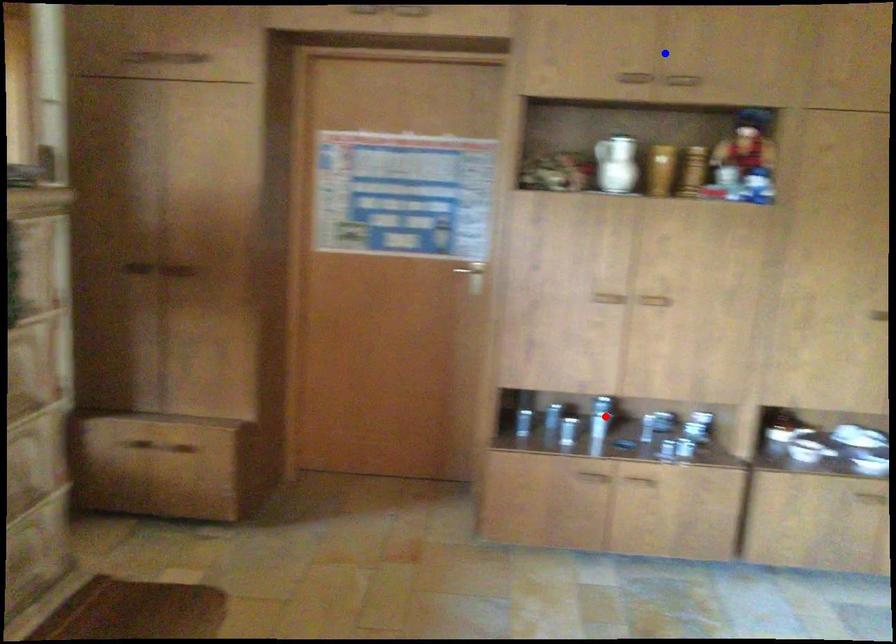
Question: Two points are marked on the image. Which point is closer to the camera?

Choices:
 (A) Blue point is closer.
 (B) Red point is closer.

Answer: (A)